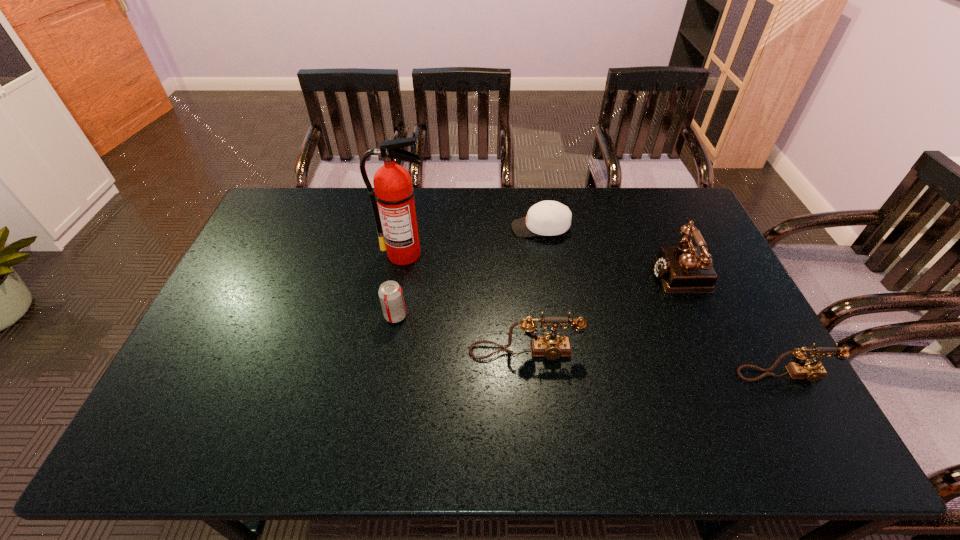
Considering the uniform spacing of telephones, where should an additional telephone be positioned on the left? Please locate a free spot. Please provide its 2D coordinates. Your answer should be formatted as a tuple, i.e. [(x, y)], where the tuple contains the x and y coordinates of a point satisfying the conditions above.

[(286, 331)]